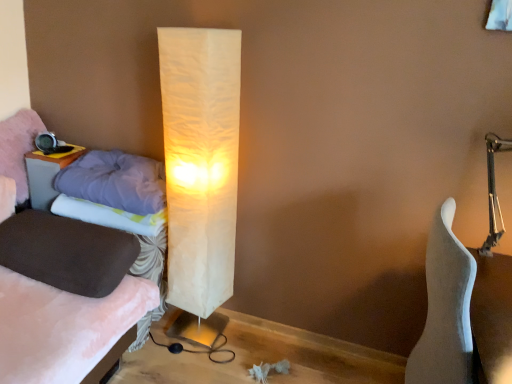
Question: Does matte wood table at left have a larger size compared to white matte guitar at right?

Choices:
 (A) no
 (B) yes

Answer: (A)

Question: Is matte wood table at left not inside white matte guitar at right?

Choices:
 (A) no
 (B) yes

Answer: (B)

Question: From a real-world perspective, is matte wood table at left below white matte guitar at right?

Choices:
 (A) no
 (B) yes

Answer: (A)

Question: Is matte wood table at left far from white matte guitar at right?

Choices:
 (A) yes
 (B) no

Answer: (A)

Question: Can you confirm if matte wood table at left is shorter than white matte guitar at right?

Choices:
 (A) no
 (B) yes

Answer: (B)

Question: From a real-world perspective, is matte wood table at left positioned above or below velvet brown bed at left?

Choices:
 (A) below
 (B) above

Answer: (B)

Question: Considering the positions of matte wood table at left and velvet brown bed at left in the image, is matte wood table at left taller or shorter than velvet brown bed at left?

Choices:
 (A) short
 (B) tall

Answer: (A)

Question: Is matte wood table at left inside or outside of velvet brown bed at left?

Choices:
 (A) inside
 (B) outside

Answer: (B)

Question: From the image's perspective, is matte wood table at left positioned above or below velvet brown bed at left?

Choices:
 (A) below
 (B) above

Answer: (B)

Question: From their relative heights in the image, would you say white fabric pillow at left, which is the 2th pillow from bottom to top, is taller or shorter than velvet purple pillow at left, the 1th pillow viewed from the top?

Choices:
 (A) tall
 (B) short

Answer: (B)

Question: Considering their positions, is white fabric pillow at left, the third pillow positioned from the top, located in front of or behind velvet purple pillow at left, the 1th pillow viewed from the top?

Choices:
 (A) behind
 (B) front

Answer: (B)

Question: Is white fabric pillow at left, which is the 2th pillow from bottom to top, bigger or smaller than velvet purple pillow at left, the fourth pillow positioned from the bottom?

Choices:
 (A) small
 (B) big

Answer: (B)

Question: Is white fabric pillow at left, which is the 2th pillow from bottom to top, inside the boundaries of velvet purple pillow at left, the 1th pillow viewed from the top, or outside?

Choices:
 (A) outside
 (B) inside

Answer: (A)

Question: From a real-world perspective, is velvet purple pillow at left, the fourth pillow positioned from the bottom, above or below matte wood table at left?

Choices:
 (A) above
 (B) below

Answer: (A)

Question: Is point (25, 196) positioned closer to the camera than point (38, 203)?

Choices:
 (A) farther
 (B) closer

Answer: (A)